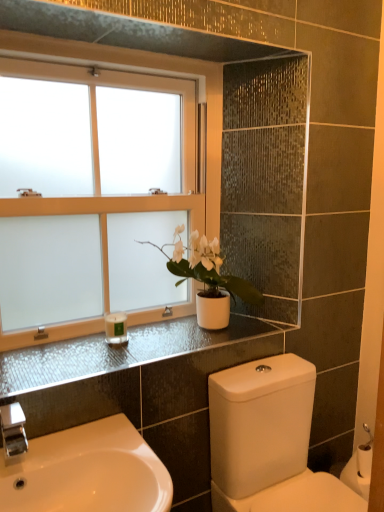
Identify the location of satin black countertop at upper center. The width and height of the screenshot is (384, 512). (125, 352).

What is the approximate height of white matte pot at center?

white matte pot at center is 16.82 inches in height.

Image resolution: width=384 pixels, height=512 pixels. Find the location of `white frosted glass window at upper left`. white frosted glass window at upper left is located at coordinates (98, 140).

What are the coordinates of `satin black countertop at upper center` in the screenshot? It's located at point(125,352).

Between satin black countertop at upper center and white frosted glass window at upper left, which one has larger width?

With larger width is satin black countertop at upper center.

From the image's perspective, is satin black countertop at upper center positioned above or below white frosted glass window at upper left?

satin black countertop at upper center is situated lower than white frosted glass window at upper left in the image.

Considering the sizes of objects white frosted glass window at upper left and satin black countertop at upper center in the image provided, who is shorter, white frosted glass window at upper left or satin black countertop at upper center?

With less height is satin black countertop at upper center.

From the picture: Considering the positions of objects white frosted glass window at upper left and satin black countertop at upper center in the image provided, who is behind, white frosted glass window at upper left or satin black countertop at upper center?

white frosted glass window at upper left.

The image size is (384, 512). Find the location of `counter top on the right side of white frosted glass window at upper left`. counter top on the right side of white frosted glass window at upper left is located at coordinates (125, 352).

From a real-world perspective, between white frosted glass window at upper left and satin black countertop at upper center, who is vertically lower?

satin black countertop at upper center is physically lower.

Considering the relative sizes of white glossy sink at lower left and satin black countertop at upper center in the image provided, is white glossy sink at lower left shorter than satin black countertop at upper center?

No.

Could you tell me if white glossy sink at lower left is turned towards satin black countertop at upper center?

No, white glossy sink at lower left is not turned towards satin black countertop at upper center.

Is white glossy sink at lower left further to camera compared to satin black countertop at upper center?

No, the depth of white glossy sink at lower left is less than that of satin black countertop at upper center.

Is white glossy sink at lower left surrounding satin black countertop at upper center?

No, satin black countertop at upper center is not surrounded by white glossy sink at lower left.

Measure the distance from white glossy sink at lower left to white glossy toilet at lower right.

white glossy sink at lower left is 50.00 centimeters from white glossy toilet at lower right.

Between white glossy sink at lower left and white glossy toilet at lower right, which one has more height?

Standing taller between the two is white glossy toilet at lower right.

Locate an element on the screen. toilet behind the white glossy sink at lower left is located at coordinates (268, 440).

From a real-world perspective, who is located lower, white glossy sink at lower left or white glossy toilet at lower right?

white glossy toilet at lower right is physically lower.

Is white frosted glass window at upper left completely or partially inside white glossy sink at lower left?

No, white glossy sink at lower left does not contain white frosted glass window at upper left.

Consider the image. Can you confirm if white glossy sink at lower left is bigger than white frosted glass window at upper left?

No.

Between white glossy sink at lower left and white frosted glass window at upper left, which one has more height?

Standing taller between the two is white frosted glass window at upper left.

Does point (10, 469) appear closer or farther from the camera than point (195, 182)?

Point (10, 469).

Which is closer to the camera, (118,318) or (233,324)?

Clearly, point (118,318) is closer to the camera than point (233,324).

From a real-world perspective, which object rests below the other?

In real-world perspective, satin black countertop at upper center is lower.

Considering the relative sizes of white matte candle at lower left and satin black countertop at upper center in the image provided, is white matte candle at lower left smaller than satin black countertop at upper center?

Correct, white matte candle at lower left occupies less space than satin black countertop at upper center.

Consider the image. Can satin black countertop at upper center be found inside white matte candle at lower left?

Actually, satin black countertop at upper center is outside white matte candle at lower left.

Is white frosted glass window at upper left to the left of white glossy toilet at lower right from the viewer's perspective?

Correct, you'll find white frosted glass window at upper left to the left of white glossy toilet at lower right.

Which is more distant, [94,85] or [301,445]?

Point [301,445]

Can we say white frosted glass window at upper left lies outside white glossy toilet at lower right?

Yes, white frosted glass window at upper left is outside of white glossy toilet at lower right.

Would you say white frosted glass window at upper left is a long distance from white glossy toilet at lower right?

They are positioned close to each other.

The height and width of the screenshot is (512, 384). What are the coordinates of `window to the left of satin black countertop at upper center` in the screenshot? It's located at (98, 140).

Where is `counter top that is under the white frosted glass window at upper left (from a real-world perspective)`? counter top that is under the white frosted glass window at upper left (from a real-world perspective) is located at coordinates (125, 352).

From the image, which object appears to be nearer to white frosted glass window at upper left, white matte pot at center or white glossy toilet at lower right?

The object closer to white frosted glass window at upper left is white matte pot at center.

When comparing their distances from white frosted glass window at upper left, does white matte candle at lower left or satin black countertop at upper center seem closer?

Based on the image, satin black countertop at upper center appears to be nearer to white frosted glass window at upper left.

Considering their positions, is white glossy toilet at lower right positioned closer to white glossy sink at lower left than white matte pot at center?

Among the two, white glossy toilet at lower right is located nearer to white glossy sink at lower left.

Which object lies further to the anchor point satin black countertop at upper center, white frosted glass window at upper left or white glossy sink at lower left?

white frosted glass window at upper left lies further to satin black countertop at upper center than the other object.

Looking at the image, which one is located closer to white glossy toilet at lower right, satin black countertop at upper center or white glossy sink at lower left?

satin black countertop at upper center is positioned closer to the anchor white glossy toilet at lower right.

Looking at the image, which one is located closer to white matte candle at lower left, white glossy sink at lower left or white glossy toilet at lower right?

white glossy sink at lower left is positioned closer to the anchor white matte candle at lower left.

Based on their spatial positions, is white matte pot at center or white matte candle at lower left closer to white frosted glass window at upper left?

white matte pot at center is closer to white frosted glass window at upper left.

Looking at the image, which one is located further to white matte candle at lower left, white frosted glass window at upper left or satin black countertop at upper center?

Among the two, white frosted glass window at upper left is located further to white matte candle at lower left.

Image resolution: width=384 pixels, height=512 pixels. Find the location of `toiletry between white frosted glass window at upper left and satin black countertop at upper center vertically`. toiletry between white frosted glass window at upper left and satin black countertop at upper center vertically is located at coordinates (116, 328).

Find the location of a particular element. The height and width of the screenshot is (512, 384). sink situated between white matte candle at lower left and white glossy toilet at lower right from left to right is located at coordinates (86, 471).

Locate an element on the screen. Image resolution: width=384 pixels, height=512 pixels. houseplant between white glossy sink at lower left and white matte candle at lower left in the front-back direction is located at coordinates (206, 268).

Identify the location of houseplant between white frosted glass window at upper left and white matte candle at lower left vertically. The width and height of the screenshot is (384, 512). (206, 268).